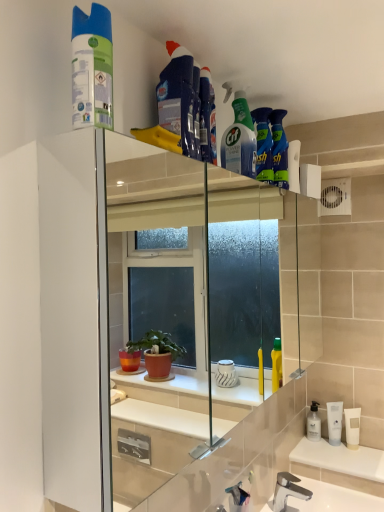
Question: From a real-world perspective, is green matte spray can at upper left, arranged as the 5th cleaning product when viewed from the right, on top of blue fabric cleaning product at upper center, which appears as the fourth cleaning product when viewed from the back?

Choices:
 (A) no
 (B) yes

Answer: (A)

Question: Would you say blue fabric cleaning product at upper center, which ranks as the 2th cleaning product in front-to-back order, is part of green matte spray can at upper left, placed as the 1th cleaning product when sorted from left to right,'s contents?

Choices:
 (A) no
 (B) yes

Answer: (A)

Question: From a real-world perspective, is green matte spray can at upper left, positioned as the 1th cleaning product in front-to-back order, located beneath blue fabric cleaning product at upper center, which appears as the second cleaning product when viewed from the left?

Choices:
 (A) yes
 (B) no

Answer: (A)

Question: Are green matte spray can at upper left, positioned as the 1th cleaning product in front-to-back order, and blue fabric cleaning product at upper center, which appears as the second cleaning product when viewed from the left, beside each other?

Choices:
 (A) yes
 (B) no

Answer: (B)

Question: Is green matte spray can at upper left, placed as the 1th cleaning product when sorted from left to right, bigger than blue fabric cleaning product at upper center, marked as the 4th cleaning product in a right-to-left arrangement?

Choices:
 (A) yes
 (B) no

Answer: (B)

Question: From a real-world perspective, is blue glossy bottle at upper center, the first cleaning product positioned from the back, positioned above or below blue fabric cleaning product at upper center, which ranks as the third cleaning product in front-to-back order?

Choices:
 (A) above
 (B) below

Answer: (B)

Question: From the image's perspective, is blue glossy bottle at upper center, the first cleaning product positioned from the back, located above or below blue fabric cleaning product at upper center, which appears as the third cleaning product when viewed from the back?

Choices:
 (A) above
 (B) below

Answer: (B)

Question: Considering the positions of blue glossy bottle at upper center, which is the fifth cleaning product from front to back, and blue fabric cleaning product at upper center, which appears as the third cleaning product when viewed from the back, in the image, is blue glossy bottle at upper center, which is the fifth cleaning product from front to back, taller or shorter than blue fabric cleaning product at upper center, which appears as the third cleaning product when viewed from the back,?

Choices:
 (A) tall
 (B) short

Answer: (A)

Question: Is blue glossy bottle at upper center, marked as the first cleaning product in a right-to-left arrangement, in front of or behind blue fabric cleaning product at upper center, which appears as the third cleaning product when viewed from the back, in the image?

Choices:
 (A) behind
 (B) front

Answer: (A)

Question: Is polished chrome faucet at lower center taller or shorter than green matte spray can at upper left, positioned as the 1th cleaning product in front-to-back order?

Choices:
 (A) tall
 (B) short

Answer: (B)

Question: Is polished chrome faucet at lower center inside or outside of green matte spray can at upper left, placed as the 1th cleaning product when sorted from left to right?

Choices:
 (A) outside
 (B) inside

Answer: (A)

Question: Is polished chrome faucet at lower center bigger or smaller than green matte spray can at upper left, positioned as the 1th cleaning product in front-to-back order?

Choices:
 (A) big
 (B) small

Answer: (A)

Question: From the image's perspective, is polished chrome faucet at lower center positioned above or below green matte spray can at upper left, marked as the 5th cleaning product in a back-to-front arrangement?

Choices:
 (A) below
 (B) above

Answer: (A)

Question: Relative to blue fabric cleaning product at upper center, which ranks as the 2th cleaning product in front-to-back order, is polished chrome faucet at lower center in front or behind?

Choices:
 (A) behind
 (B) front

Answer: (A)

Question: Is polished chrome faucet at lower center taller or shorter than blue fabric cleaning product at upper center, which appears as the second cleaning product when viewed from the left?

Choices:
 (A) short
 (B) tall

Answer: (A)